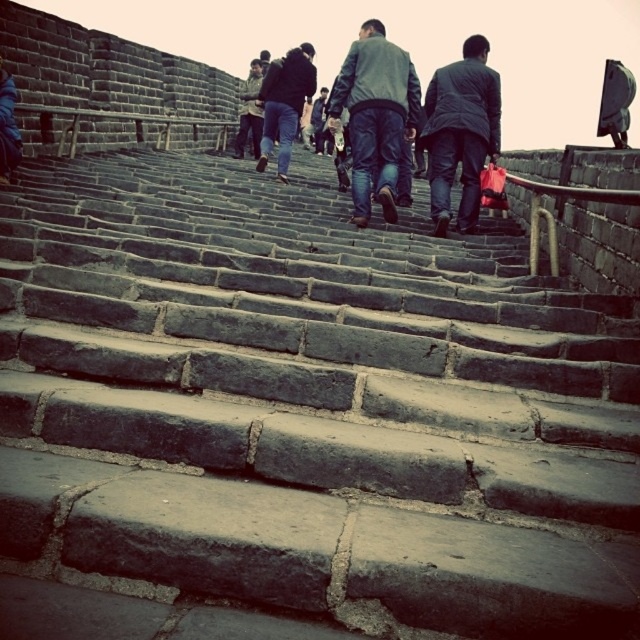
Is point (346, 104) closer to camera compared to point (468, 192)?

No, it is behind (468, 192).

Is point (339, 81) more distant than point (484, 120)?

Yes, point (339, 81) is behind point (484, 120).

Describe the element at coordinates (376, 115) in the screenshot. This screenshot has width=640, height=640. I see `dark gray jacket at center` at that location.

The height and width of the screenshot is (640, 640). I want to click on dark gray jacket at center, so click(x=376, y=115).

Is dark gray jacket at center below dark gray jeans at center?

Indeed, dark gray jacket at center is positioned under dark gray jeans at center.

Can you confirm if dark gray jacket at center is positioned to the left of dark gray jeans at center?

No, dark gray jacket at center is not to the left of dark gray jeans at center.

Between point (403, 118) and point (248, 84), which one is positioned in front?

Point (403, 118) is more forward.

You are a GUI agent. You are given a task and a screenshot of the screen. Output one action in this format:
    pyautogui.click(x=<x>, y=<y>)
    Task: Click on the dark gray jacket at center
    The image size is (640, 640).
    Given the screenshot: What is the action you would take?
    pyautogui.click(x=376, y=115)

Does dark gray jacket at center come behind dark blue jeans at center?

No, it is not.

The image size is (640, 640). Describe the element at coordinates (376, 115) in the screenshot. I see `dark gray jacket at center` at that location.

Identify the location of dark gray jacket at center. The height and width of the screenshot is (640, 640). (376, 115).